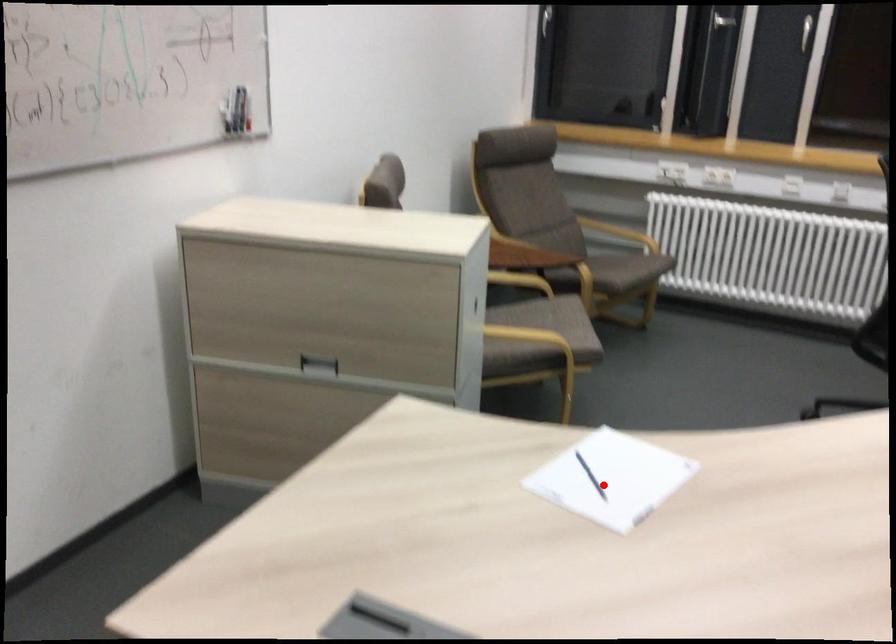
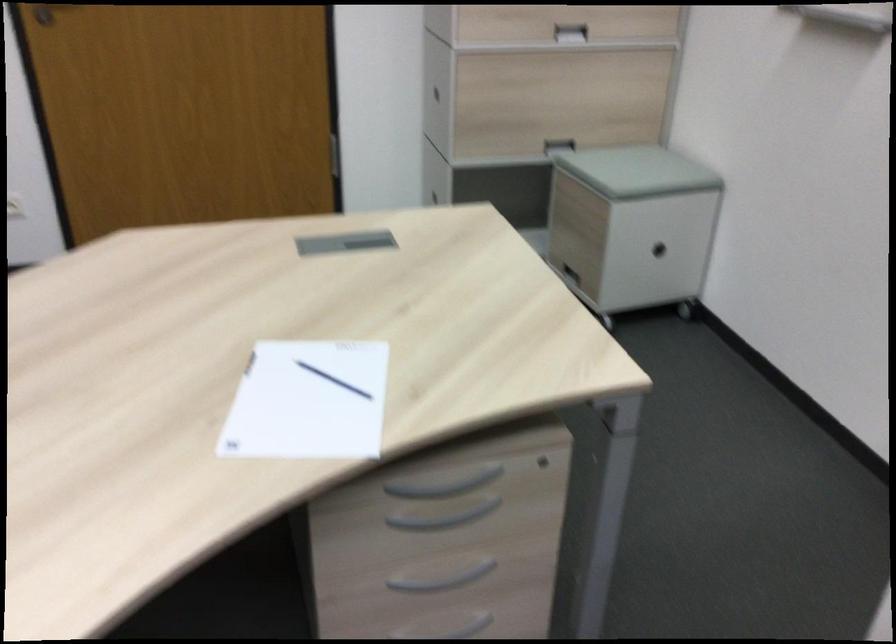
Find the pixel in the second image that matches the highlighted location in the first image.

(307, 402)